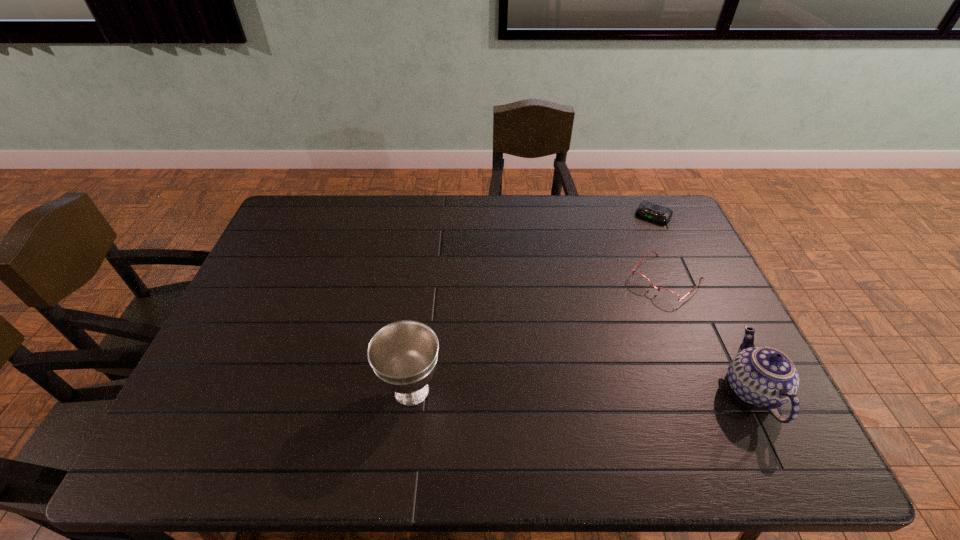
Image resolution: width=960 pixels, height=540 pixels. Identify the location of free area in between the chinaware and the farthest object. (703, 303).

At what (x,y) coordinates should I click in order to perform the action: click on free space between the tallest object and the third shortest object. Please return your answer as a coordinate pair (x, y). The height and width of the screenshot is (540, 960). Looking at the image, I should click on (582, 390).

Locate an element on the screen. The image size is (960, 540). empty space between the chinaware and the leftmost object is located at coordinates click(582, 390).

Find the location of `free point between the spectacles and the farthest object`. free point between the spectacles and the farthest object is located at coordinates (660, 247).

Where is `vacant area that lies between the chinaware and the tallest object`? Image resolution: width=960 pixels, height=540 pixels. vacant area that lies between the chinaware and the tallest object is located at coordinates (582, 390).

Identify the location of empty location between the alarm clock and the chalice. This screenshot has width=960, height=540. (533, 303).

This screenshot has width=960, height=540. I want to click on vacant region between the alarm clock and the third tallest object, so click(660, 247).

Locate an element on the screen. This screenshot has width=960, height=540. free space between the chalice and the second tallest object is located at coordinates (582, 390).

Locate an element on the screen. The width and height of the screenshot is (960, 540). object that is the closest one to the tallest object is located at coordinates (640, 278).

I want to click on object that is the second closest to the leftmost object, so click(765, 377).